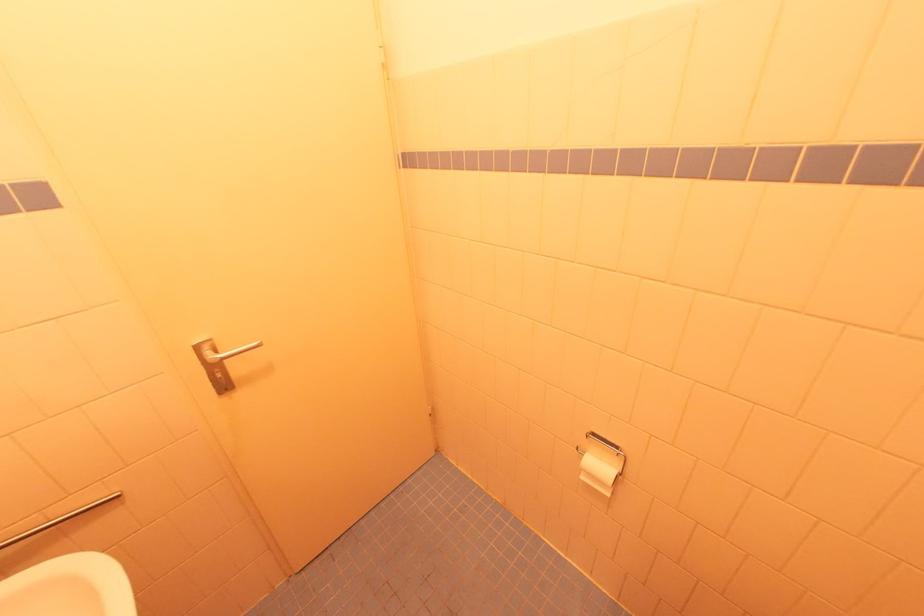
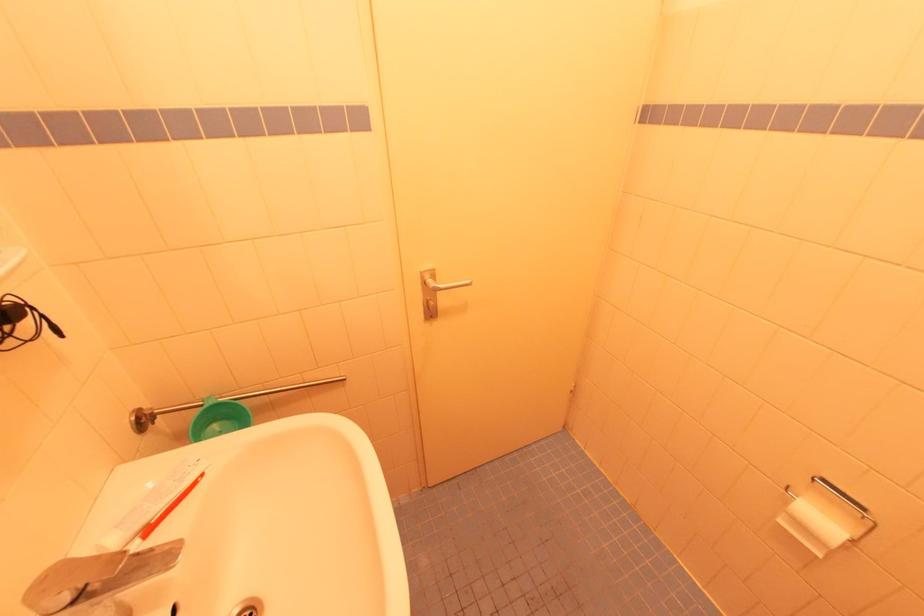
Question: What movement of the cameraman would produce the second image?

Choices:
 (A) Left
 (B) Right
 (C) Forward
 (D) Backward

Answer: (A)